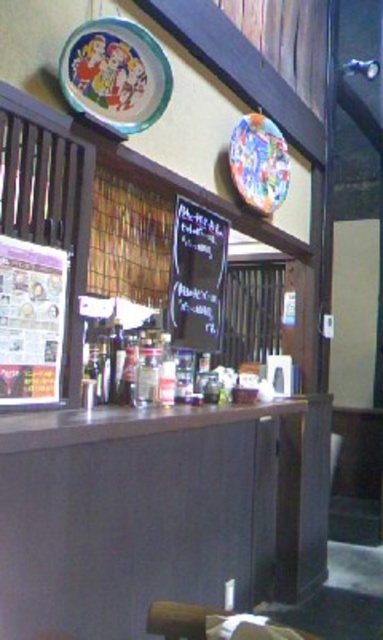
You are standing at the entrance of the dining establishment and see a point marked at coordinates (158, 513). Based on the scene description, where is this point located?

The point is located on the smooth dark wood table at center.

You are a customer waiting to order at the smooth dark wood table at center. You notice the colorful glossy plate at upper center. Can you reach it without moving from your seat?

The smooth dark wood table at center is taller than the colorful glossy plate at upper center, so the plate is lower and might be within reach. However, since the table itself is tall, you might need to stretch or stand to reach the plate, depending on your height and seating position.

You are a customer standing at the counter in the dining establishment. You want to read the menu displayed on the black chalkboard at center and also look at the colorful glossy plate at upper center. Which object is taller?

The black chalkboard at center is much taller than the colorful glossy plate at upper center.